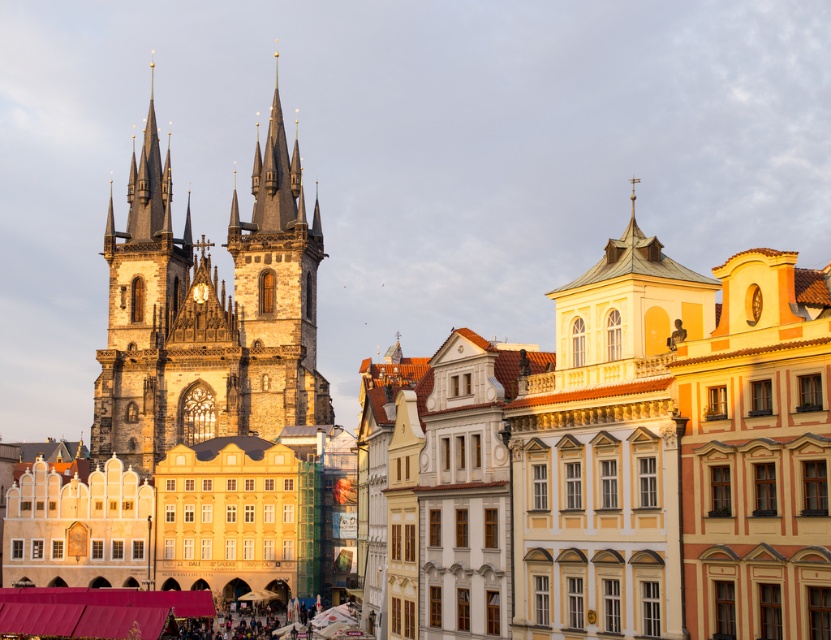
Does dark stone tower at left have a greater width compared to dark stone tower at center?

Yes, dark stone tower at left is wider than dark stone tower at center.

Measure the distance between dark stone tower at left and camera.

dark stone tower at left is 139.72 meters from camera.

Locate an element on the screen. The image size is (831, 640). dark stone tower at left is located at coordinates (209, 314).